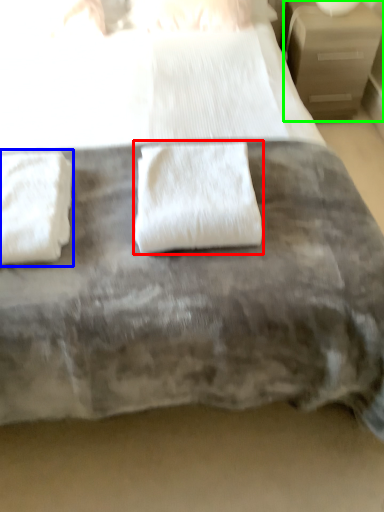
Question: Which object is the farthest from towel (highlighted by a red box)? Choose among these: towel (highlighted by a blue box) or nightstand (highlighted by a green box).

Choices:
 (A) towel
 (B) nightstand

Answer: (B)